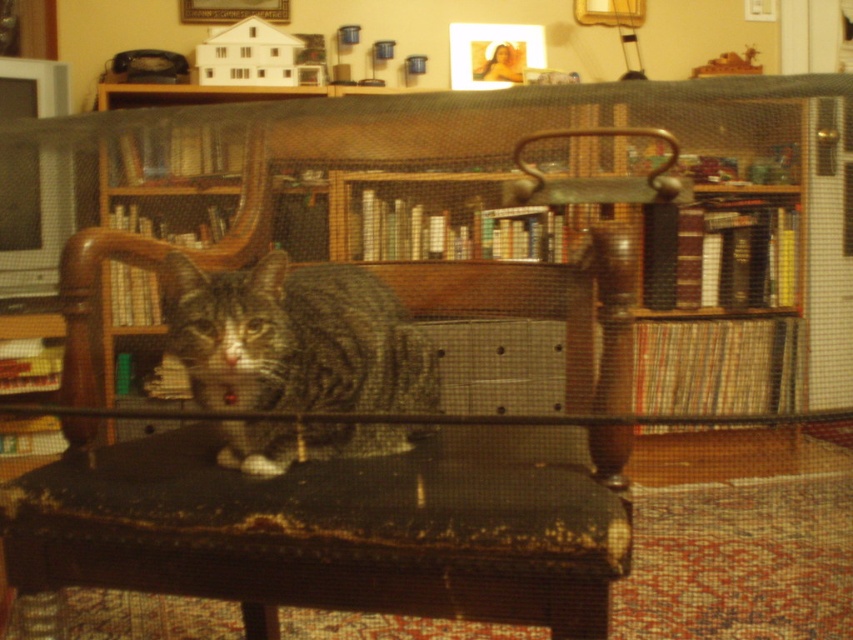
Question: Can you confirm if dark brown wooden table at center is positioned below wooden bookshelf at center?

Choices:
 (A) yes
 (B) no

Answer: (A)

Question: Is the position of dark brown leather armchair at center more distant than that of wooden bookshelf at center?

Choices:
 (A) no
 (B) yes

Answer: (A)

Question: Can you confirm if dark brown leather armchair at center is positioned below dark brown wooden table at center?

Choices:
 (A) yes
 (B) no

Answer: (B)

Question: Among these objects, which one is nearest to the camera?

Choices:
 (A) tabby fur cat at center
 (B) wooden bookshelf at center
 (C) dark brown leather armchair at center
 (D) dark brown wooden table at center

Answer: (C)

Question: Which point is farther to the camera?

Choices:
 (A) (242, 454)
 (B) (596, 484)

Answer: (A)

Question: Which point is closer to the camera?

Choices:
 (A) (242, 380)
 (B) (497, 500)
 (C) (432, 266)

Answer: (B)